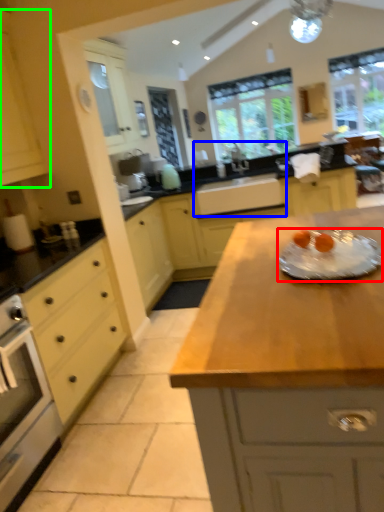
Question: Considering the real-world distances, which object is closest to glass plate (highlighted by a red box)? sink (highlighted by a blue box) or cabinetry (highlighted by a green box).

Choices:
 (A) sink
 (B) cabinetry

Answer: (B)